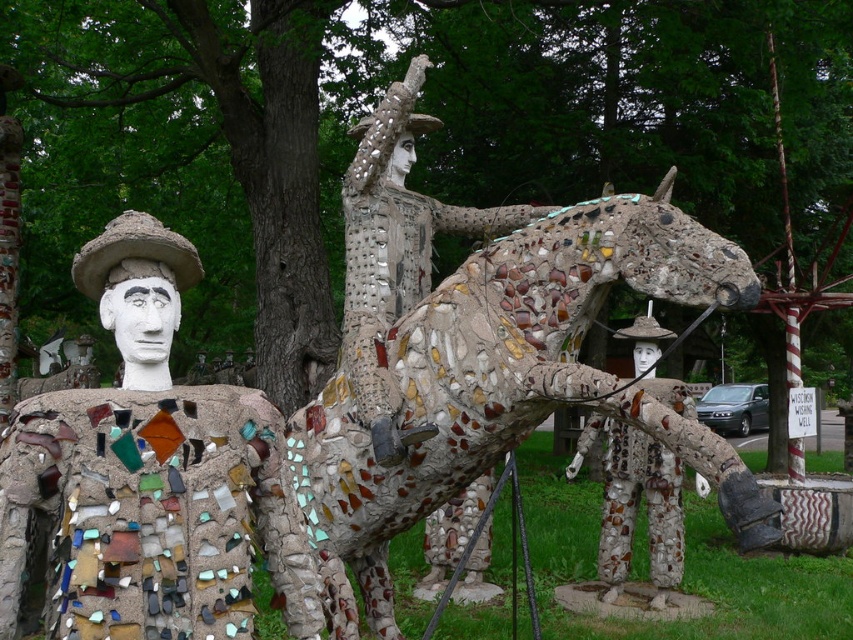
Question: Does mosaic horse at center appear on the left side of mosaic man at left?

Choices:
 (A) no
 (B) yes

Answer: (A)

Question: Which point is farther to the camera?

Choices:
 (A) (149, 637)
 (B) (422, 353)

Answer: (B)

Question: Does mosaic horse at center come in front of mosaic man at left?

Choices:
 (A) no
 (B) yes

Answer: (A)

Question: Among these objects, which one is nearest to the camera?

Choices:
 (A) mosaic man at left
 (B) mosaic horse at center

Answer: (A)

Question: Does mosaic horse at center have a larger size compared to mosaic man at left?

Choices:
 (A) no
 (B) yes

Answer: (B)

Question: Which point is farther from the camera taking this photo?

Choices:
 (A) (570, 355)
 (B) (264, 424)

Answer: (A)